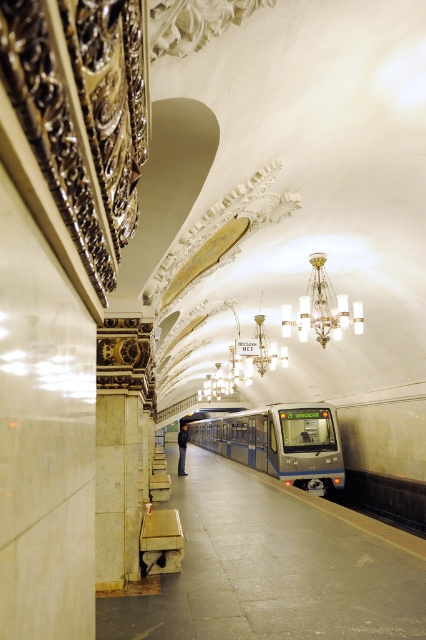
Question: Which object appears closest to the camera in this image?

Choices:
 (A) blue metallic train at center
 (B) clear glass chandelier at upper center

Answer: (B)

Question: Is blue metallic train at center in front of clear glass chandelier at upper center?

Choices:
 (A) no
 (B) yes

Answer: (A)

Question: In this image, where is blue metallic train at center located relative to clear glass chandelier at upper center?

Choices:
 (A) above
 (B) below

Answer: (B)

Question: Is blue metallic train at center wider than clear glass chandelier at upper center?

Choices:
 (A) no
 (B) yes

Answer: (B)